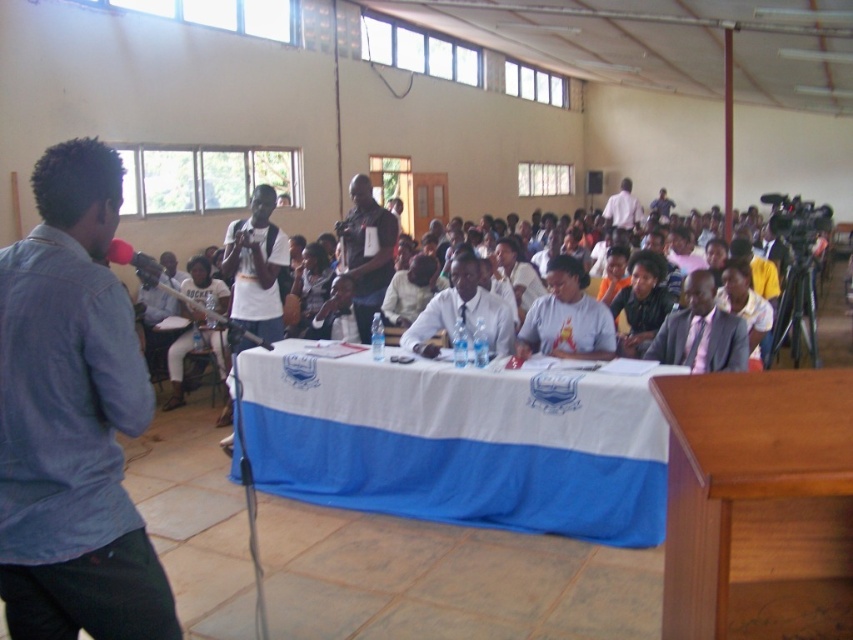
You are attending a formal event and notice two men in blue shirts. The first man is wearing a blue denim shirt at left, and the second is wearing a dark blue shirt at center. Which man is positioned closer to the left side of the room?

The blue denim shirt at left is positioned closer to the left side of the room compared to the dark blue shirt at center.

You are organizing a small meeting and need to seat 8 people. The blue fabric table at center and wooden podium at lower right are available. Which one can accommodate more people?

The blue fabric table at center has a larger width than the wooden podium at lower right, so it can accommodate more people.